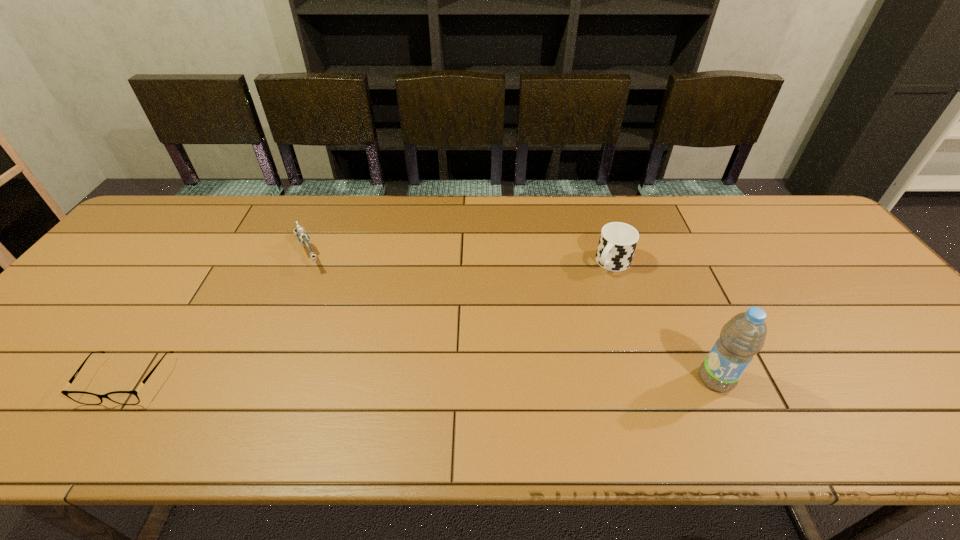
I want to click on blank region between the rightmost object and the second object from right to left, so click(664, 321).

This screenshot has height=540, width=960. In order to click on free space between the water bottle and the third object from right to left in this screenshot , I will do `click(512, 316)`.

This screenshot has height=540, width=960. In order to click on blank region between the leftmost object and the cup in this screenshot , I will do `click(370, 321)`.

Locate which object is the closest to the third object from right to left. Please provide its 2D coordinates. Your answer should be formatted as a tuple, i.e. [(x, y)], where the tuple contains the x and y coordinates of a point satisfying the conditions above.

[(121, 397)]

Identify which object is located as the nearest to the second shortest object. Please provide its 2D coordinates. Your answer should be formatted as a tuple, i.e. [(x, y)], where the tuple contains the x and y coordinates of a point satisfying the conditions above.

[(121, 397)]

This screenshot has width=960, height=540. I want to click on free region that satisfies the following two spatial constraints: 1. on the front side of the third object from left to right; 2. on the right side of the gun, so click(x=304, y=262).

This screenshot has width=960, height=540. Identify the location of free region that satisfies the following two spatial constraints: 1. on the front side of the cup; 2. on the left side of the tallest object. (650, 379).